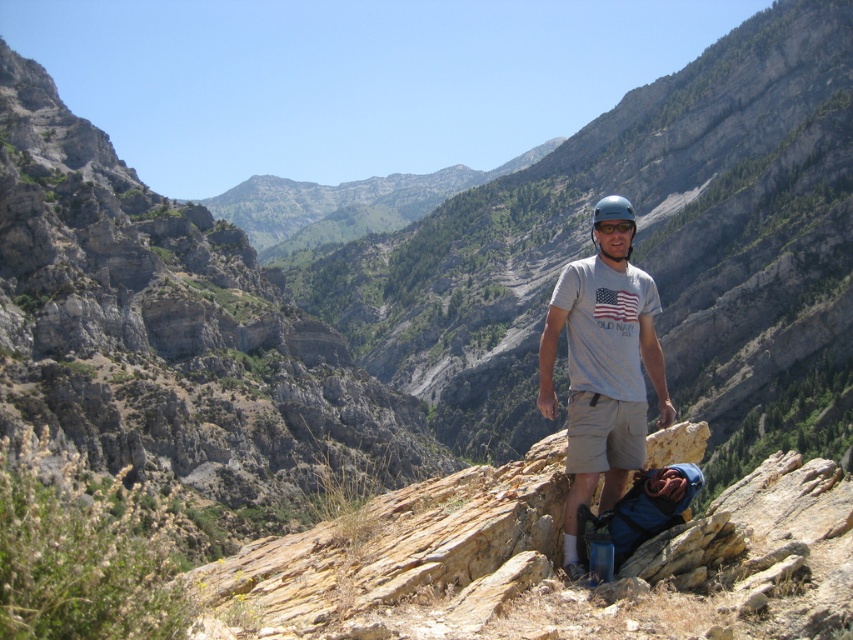
Question: Among these objects, which one is nearest to the camera?

Choices:
 (A) blue matte helmet at center
 (B) gray cotton t-shirt at center

Answer: (B)

Question: Among these points, which one is nearest to the camera?

Choices:
 (A) (543, 401)
 (B) (592, 211)

Answer: (A)

Question: Is gray cotton t-shirt at center further to the viewer compared to blue matte helmet at center?

Choices:
 (A) yes
 (B) no

Answer: (B)

Question: Does gray cotton t-shirt at center appear over blue matte helmet at center?

Choices:
 (A) no
 (B) yes

Answer: (A)

Question: Among these objects, which one is nearest to the camera?

Choices:
 (A) blue matte helmet at center
 (B) gray cotton t-shirt at center

Answer: (B)

Question: From the image, what is the correct spatial relationship of gray cotton t-shirt at center in relation to blue matte helmet at center?

Choices:
 (A) below
 (B) above

Answer: (A)